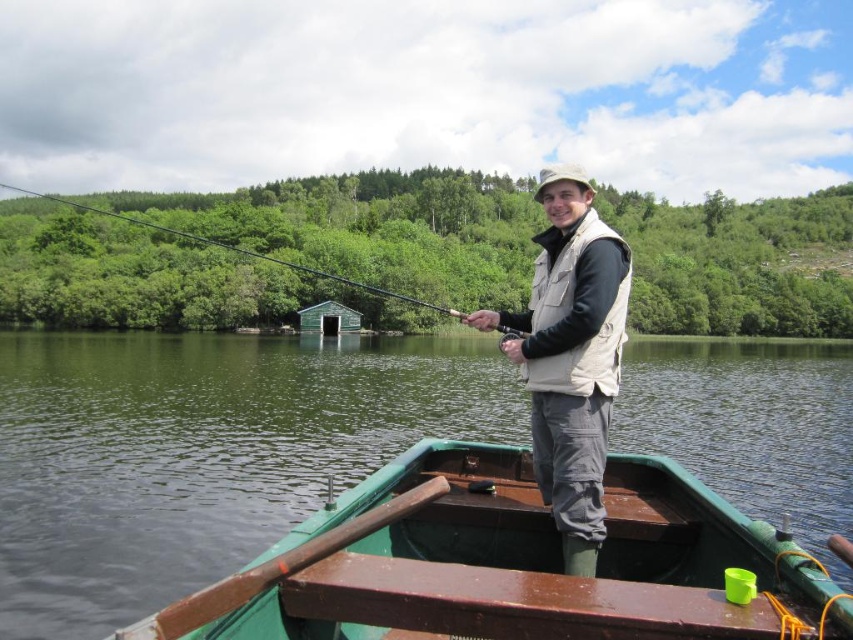
Question: Which point appears closest to the camera in this image?

Choices:
 (A) (28, 192)
 (B) (601, 410)
 (C) (608, 634)

Answer: (C)

Question: Among these points, which one is farthest from the camera?

Choices:
 (A) (606, 314)
 (B) (544, 525)
 (C) (91, 209)

Answer: (C)

Question: Can you confirm if beige fabric vest at center is positioned below green matte fishing pole at upper center?

Choices:
 (A) no
 (B) yes

Answer: (B)

Question: Which point is farther to the camera?

Choices:
 (A) green wooden boat at center
 (B) beige fabric vest at center

Answer: (A)

Question: Does green wooden boat at center come in front of beige fabric vest at center?

Choices:
 (A) yes
 (B) no

Answer: (B)

Question: From the image, what is the correct spatial relationship of green wooden boat at center in relation to beige fabric vest at center?

Choices:
 (A) left
 (B) right

Answer: (A)